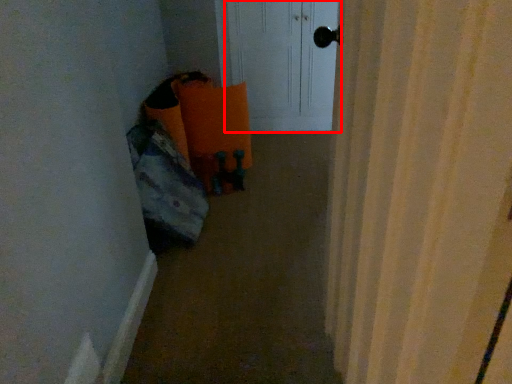
Question: From the image's perspective, where is screen door (annotated by the red box) located relative to corridor?

Choices:
 (A) below
 (B) above

Answer: (B)